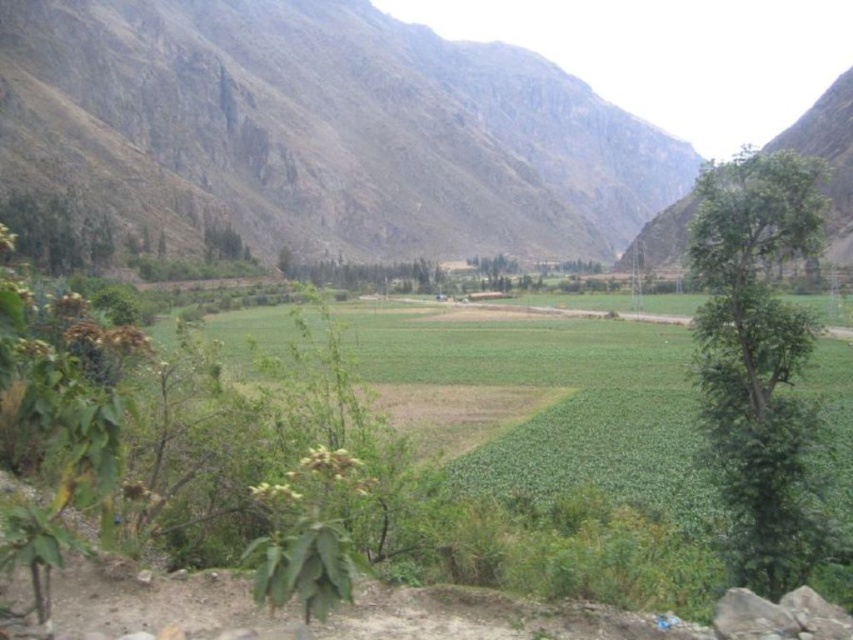
From the picture: You are standing in the rural landscape and want to take a photo of the brown rocky mountain at upper center and the green leafy tree at right. Which object should you focus on first if you want both to be in sharp focus?

The green leafy tree at right should be focused on first because the brown rocky mountain at upper center is above it, meaning the mountain is farther away. To get both in focus, start focusing on the closer object, which is the green leafy tree at right.

You are standing in the rural landscape and want to walk from the point at coordinates point (x=479, y=188) to the point at coordinates point (x=439, y=289). Which direction should you move to get closer to your destination?

To move from point (x=479, y=188) to point (x=439, y=289), you should move towards the camera because point (x=439, y=289) is closer to the camera than point (x=479, y=188).